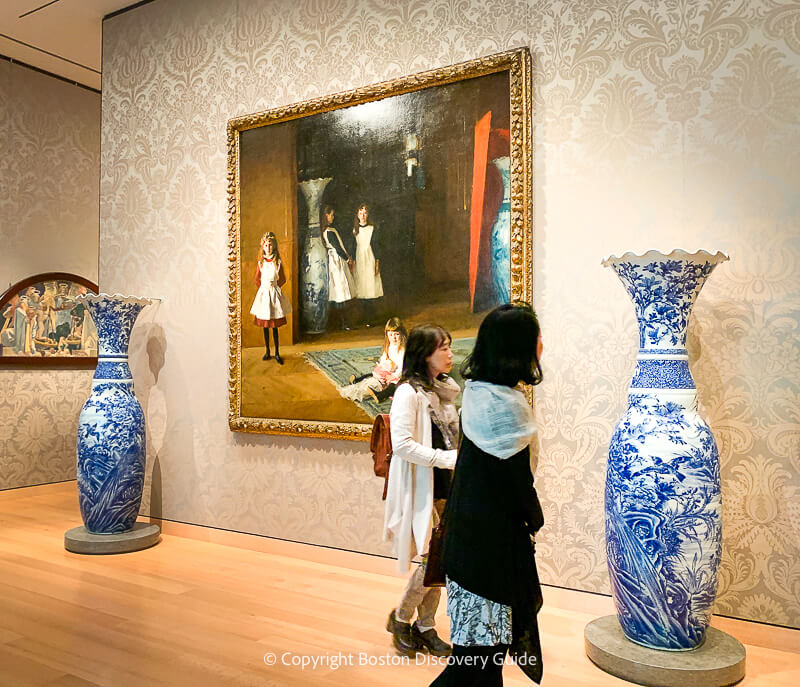
The image size is (800, 687). What are the coordinates of `painting floor` in the screenshot? It's located at (300, 385).